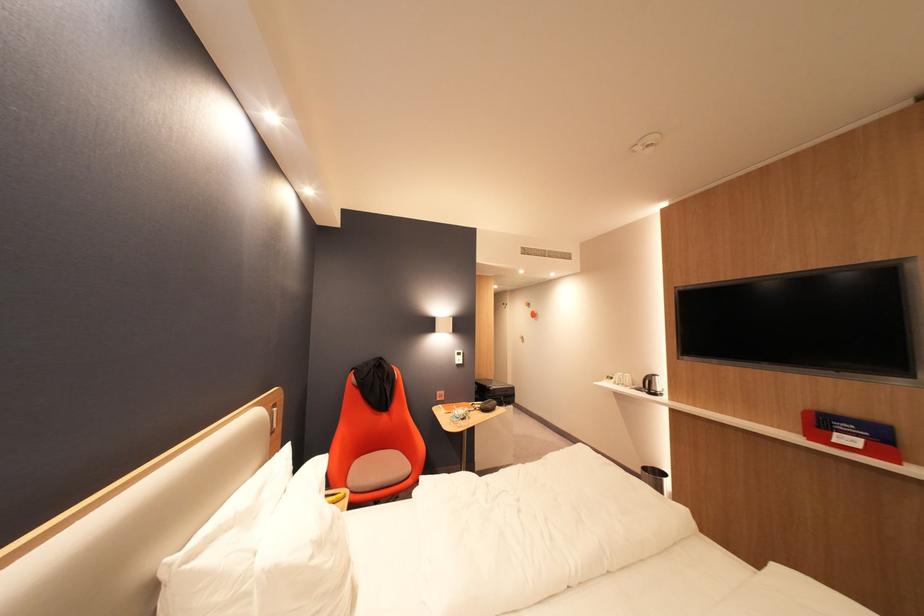
Describe the element at coordinates (378, 469) in the screenshot. The image size is (924, 616). I see `a orange chair sitting surface` at that location.